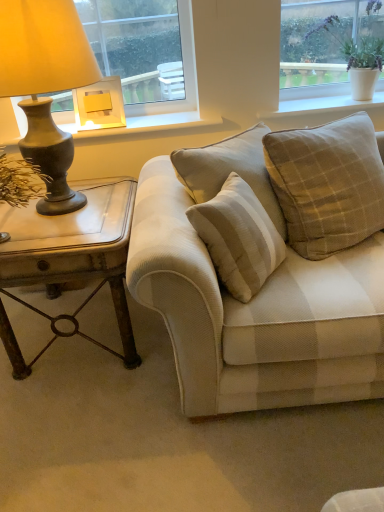
Question: Looking at the image, does white ceramic pot at upper right, which appears as the first window when viewed from the right, seem bigger or smaller compared to matte bronze lamp at left, marked as the 1th lamp in a front-to-back arrangement?

Choices:
 (A) big
 (B) small

Answer: (B)

Question: From a real-world perspective, is white ceramic pot at upper right, positioned as the 2th window in left-to-right order, physically located above or below matte bronze lamp at left, marked as the 1th lamp in a front-to-back arrangement?

Choices:
 (A) above
 (B) below

Answer: (A)

Question: Which object is the farthest from the beige textured pillow at center, the 1th pillow viewed from the left?

Choices:
 (A) yellow fabric at upper left, arranged as the second window when viewed from the right
 (B) rustic wood side table at left
 (C) beige textured couch at center
 (D) matte gold lampshade at upper left, which is the 2th lamp in front-to-back order
 (E) beige checkered pillow at upper right, which ranks as the second pillow in left-to-right order

Answer: (D)

Question: Considering the real-world distances, which object is farthest from the rustic wood side table at left?

Choices:
 (A) yellow fabric at upper left, arranged as the second window when viewed from the right
 (B) matte wood window sill at upper center
 (C) beige checkered pillow at upper right, the first pillow when ordered from right to left
 (D) matte gold lampshade at upper left, the first lamp viewed from the back
 (E) beige textured couch at center

Answer: (A)